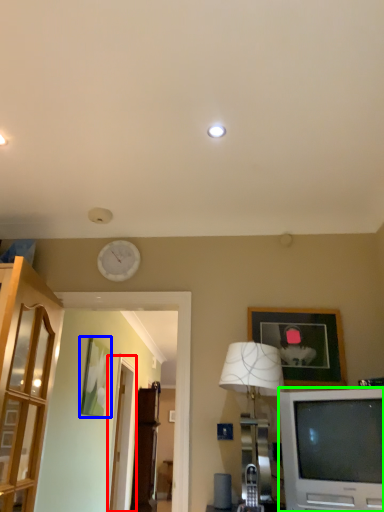
Question: Which object is the farthest from glass door (highlighted by a red box)? Choose among these: picture frame (highlighted by a blue box) or television (highlighted by a green box).

Choices:
 (A) picture frame
 (B) television

Answer: (B)